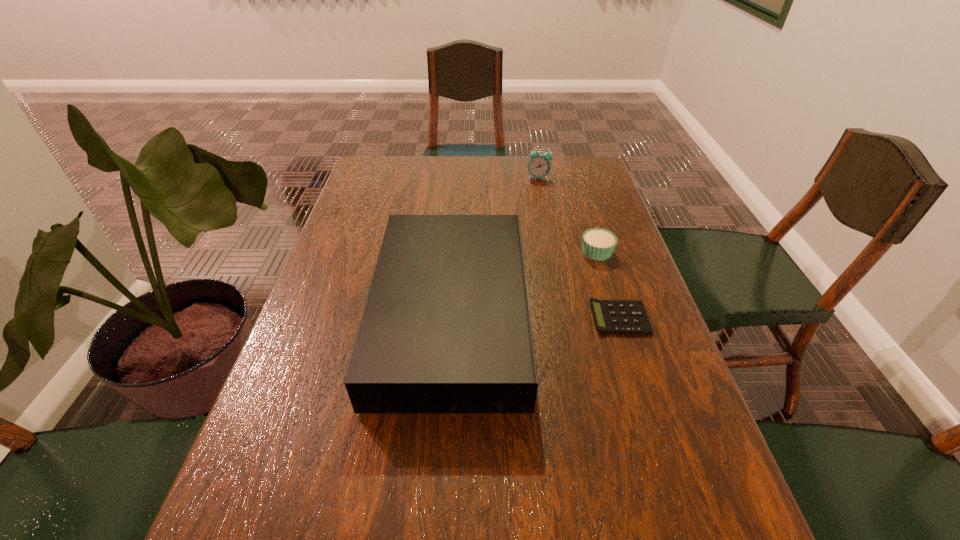
At what (x,y) coordinates should I click in order to perform the action: click on the farthest object. Please return your answer as a coordinate pair (x, y). The image size is (960, 540). Looking at the image, I should click on (539, 166).

At what (x,y) coordinates should I click in order to perform the action: click on alarm clock. Please return your answer as a coordinate pair (x, y). The image size is (960, 540). Looking at the image, I should click on (539, 166).

You are a GUI agent. You are given a task and a screenshot of the screen. Output one action in this format:
    pyautogui.click(x=<x>, y=<y>)
    Task: Click on the CD player
    
    Given the screenshot: What is the action you would take?
    pyautogui.click(x=446, y=328)

This screenshot has height=540, width=960. Find the location of `the second shortest object`. the second shortest object is located at coordinates (598, 244).

What are the coordinates of `calculator` in the screenshot? It's located at (611, 316).

Identify the location of vacant space located on the face of the second object from left to right. This screenshot has width=960, height=540. (551, 242).

This screenshot has width=960, height=540. What are the coordinates of `vacant space located at the front of the CD player for disc insertion` in the screenshot? It's located at coord(549,315).

Where is `free space located 0.050m on the left of the cupcake`? free space located 0.050m on the left of the cupcake is located at coordinates (562, 252).

This screenshot has width=960, height=540. Identify the location of blank space located 0.210m on the left of the calculator. (503, 318).

Find the location of a particular element. The height and width of the screenshot is (540, 960). object situated at the far edge is located at coordinates (539, 166).